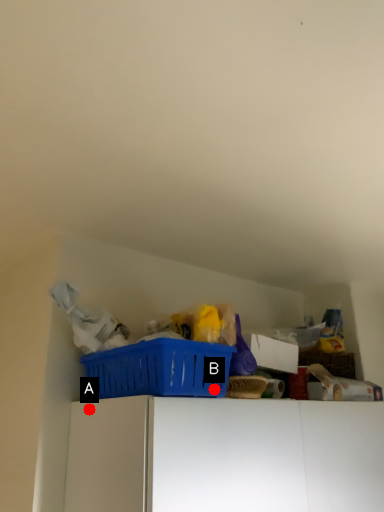
Question: Two points are circled on the image, labeled by A and B beside each circle. Which point is farther from the camera taking this photo?

Choices:
 (A) A is further
 (B) B is further

Answer: (A)